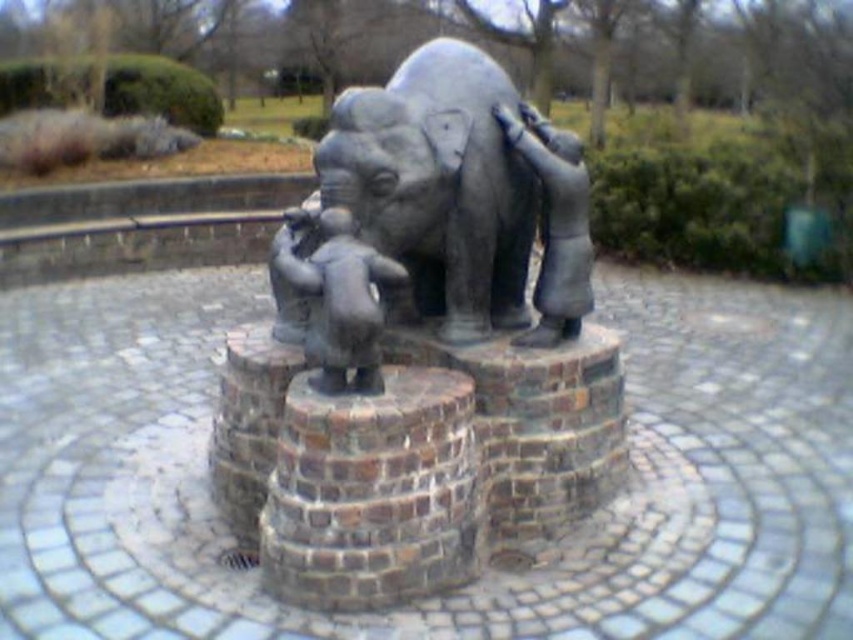
From the picture: Is bronze statue of elephant at center bigger than brown brick stump at center?

Yes.

Does point (437, 65) come farther from viewer compared to point (352, 576)?

Yes.

You are a GUI agent. You are given a task and a screenshot of the screen. Output one action in this format:
    pyautogui.click(x=<x>, y=<y>)
    Task: Click on the bronze statue of elephant at center
    This screenshot has height=640, width=853.
    Given the screenshot: What is the action you would take?
    pyautogui.click(x=440, y=184)

Can you confirm if bronze statue of elephant at center is smaller than polished bronze statue at center?

No.

Does point (473, 61) come closer to viewer compared to point (558, 312)?

No, it is not.

Is point (494, 220) positioned in front of point (563, 291)?

That is True.

Locate an element on the screen. bronze statue of elephant at center is located at coordinates (440, 184).

Between brown brick stump at center and polished bronze statue at center, which one is positioned higher?

polished bronze statue at center

Is brown brick stump at center thinner than polished bronze statue at center?

No.

Does point (379, 460) lie in front of point (509, 113)?

Yes, it is.

At what (x,y) coordinates should I click in order to perform the action: click on brown brick stump at center. Please return your answer as a coordinate pair (x, y). The height and width of the screenshot is (640, 853). Looking at the image, I should click on (x=373, y=492).